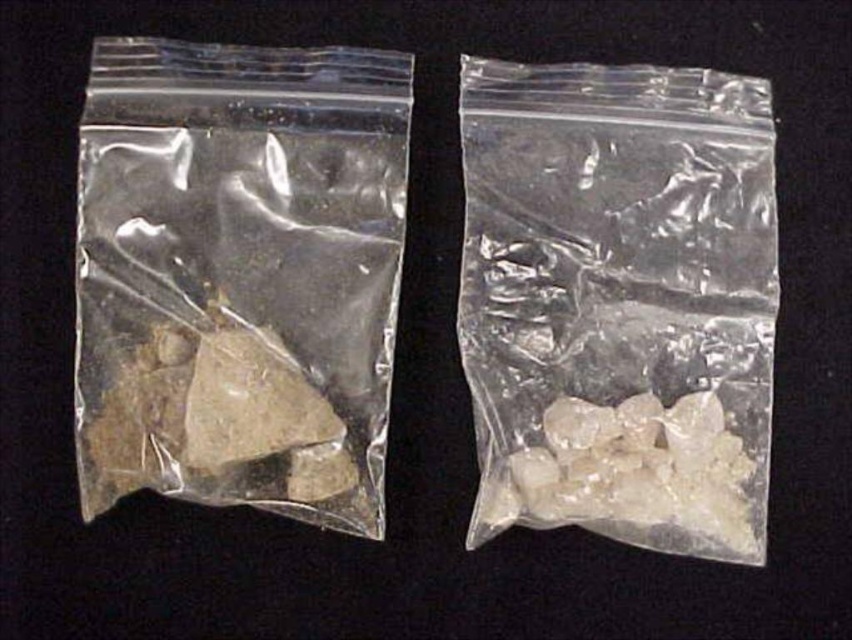
Question: Is translucent plastic bag at left below transparent plastic bag at center?

Choices:
 (A) yes
 (B) no

Answer: (B)

Question: Is transparent plastic bag at center smaller than translucent crystal chunks at right?

Choices:
 (A) yes
 (B) no

Answer: (B)

Question: Can you confirm if transparent plastic bag at center is wider than translucent crystal chunks at right?

Choices:
 (A) no
 (B) yes

Answer: (B)

Question: Which point is farther to the camera?

Choices:
 (A) translucent plastic bag at left
 (B) transparent plastic bag at center

Answer: (B)

Question: Which point appears closest to the camera in this image?

Choices:
 (A) (684, 214)
 (B) (233, 461)

Answer: (B)

Question: Estimate the real-world distances between objects in this image. Which object is closer to the translucent crystal chunks at right?

Choices:
 (A) translucent plastic bag at left
 (B) transparent plastic bag at center

Answer: (B)